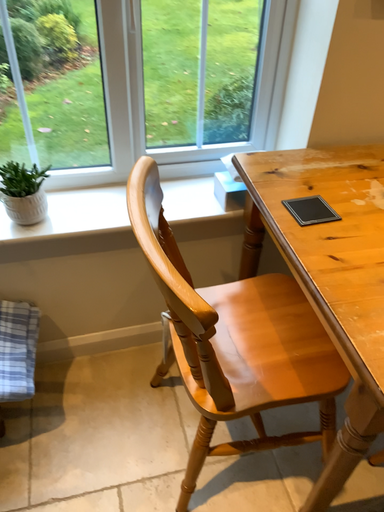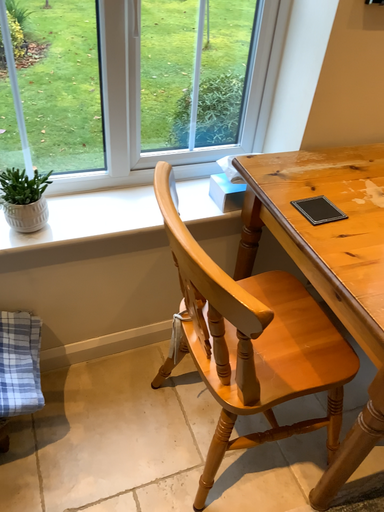
Question: How did the camera likely rotate when shooting the video?

Choices:
 (A) rotated left
 (B) rotated right

Answer: (B)